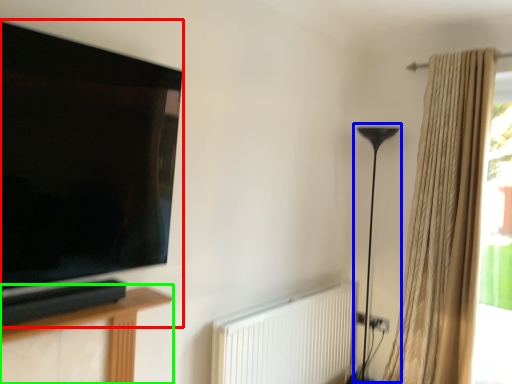
Question: Which object is positioned closest to television (highlighted by a red box)? Select from table lamp (highlighted by a blue box) and furniture (highlighted by a green box).

Choices:
 (A) table lamp
 (B) furniture

Answer: (B)